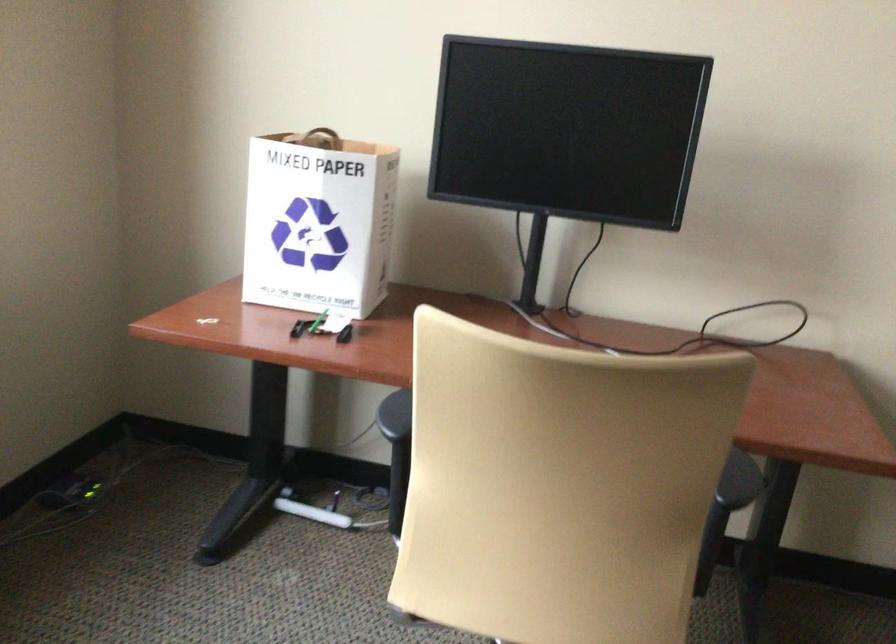
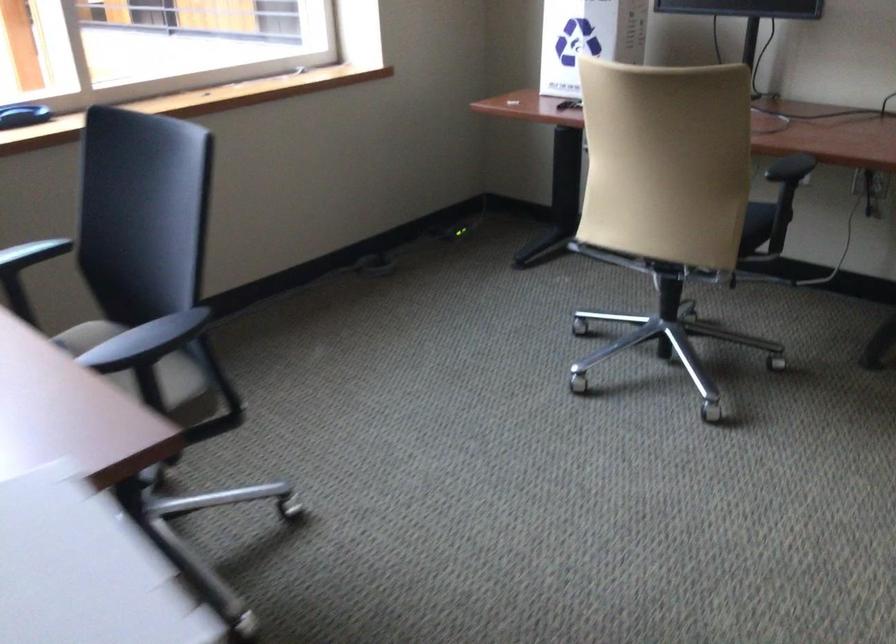
Where in the second image is the point corresponding to pixel 656 567 from the first image?

(755, 225)